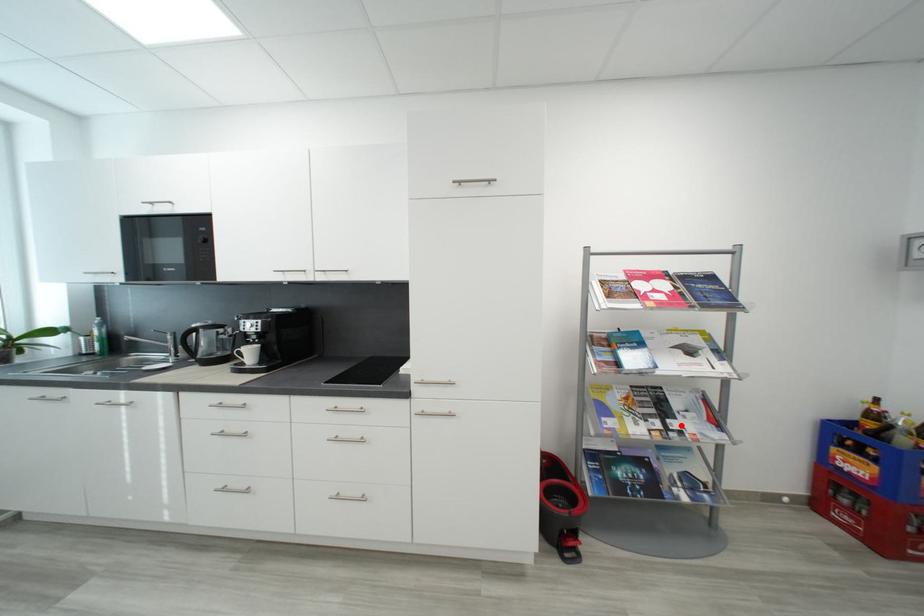
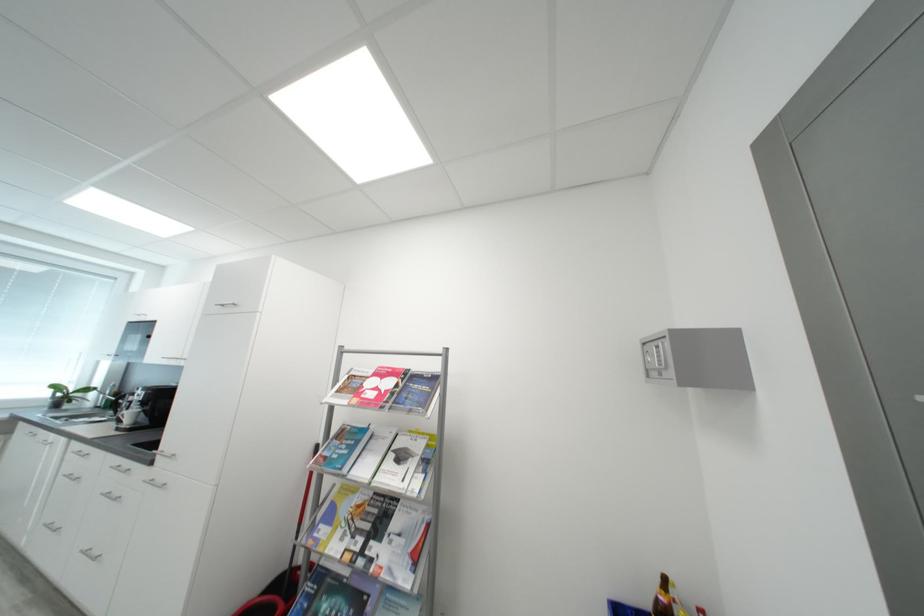
Where in the second image is the point corresponding to the highlighted location from the first image?

(380, 549)